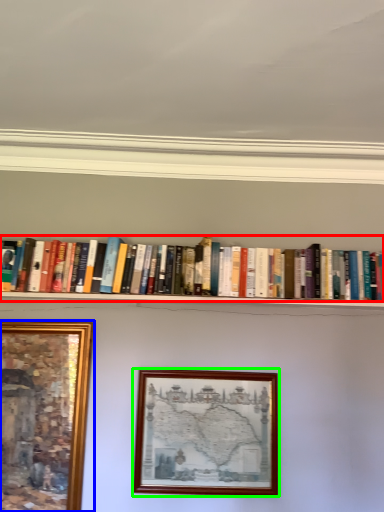
Question: Which object is positioned closest to book (highlighted by a red box)? Select from picture frame (highlighted by a blue box) and picture frame (highlighted by a green box).

Choices:
 (A) picture frame
 (B) picture frame

Answer: (B)